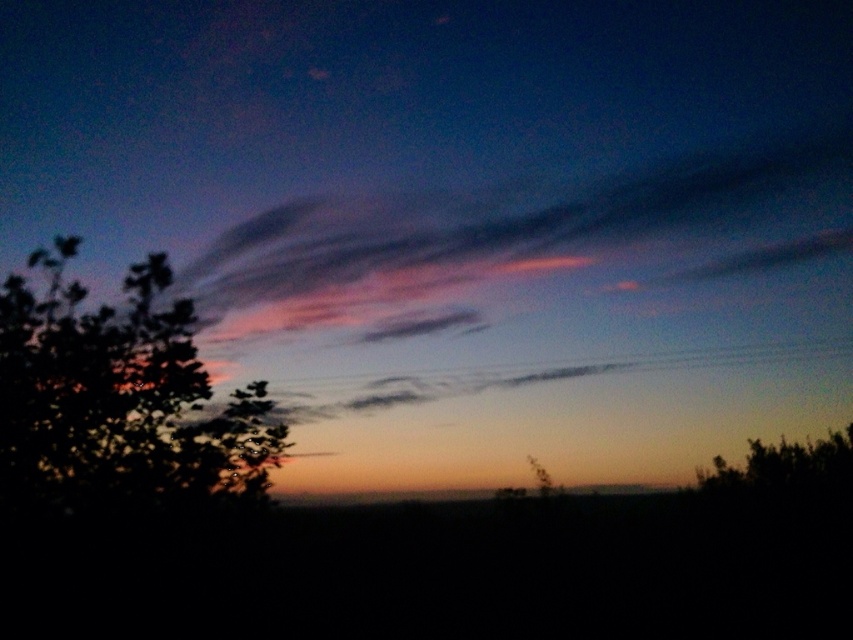
Question: Which of the following is the closest to the observer?

Choices:
 (A) smooth dark ground at center
 (B) pink translucent clouds at upper center

Answer: (B)

Question: Which object appears closest to the camera in this image?

Choices:
 (A) pink translucent clouds at upper center
 (B) green leafy tree at left

Answer: (B)

Question: Is pink translucent clouds at upper center above green leafy tree at left?

Choices:
 (A) yes
 (B) no

Answer: (A)

Question: Can you confirm if pink translucent clouds at upper center is positioned above smooth dark ground at center?

Choices:
 (A) yes
 (B) no

Answer: (A)

Question: Can you confirm if green leafy tree at left is wider than smooth dark ground at center?

Choices:
 (A) no
 (B) yes

Answer: (B)

Question: Among these objects, which one is nearest to the camera?

Choices:
 (A) pink translucent clouds at upper center
 (B) green leafy tree at left
 (C) smooth dark ground at center

Answer: (B)